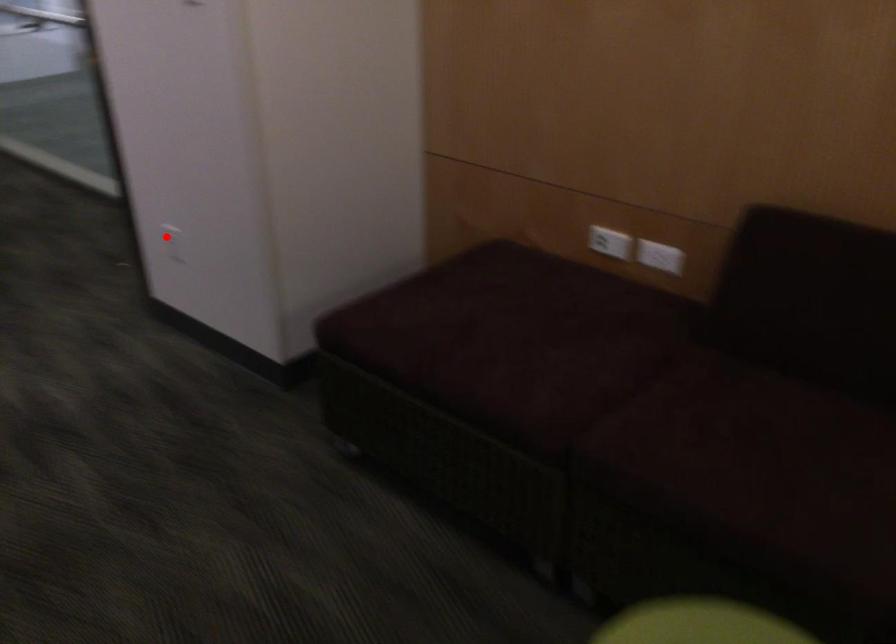
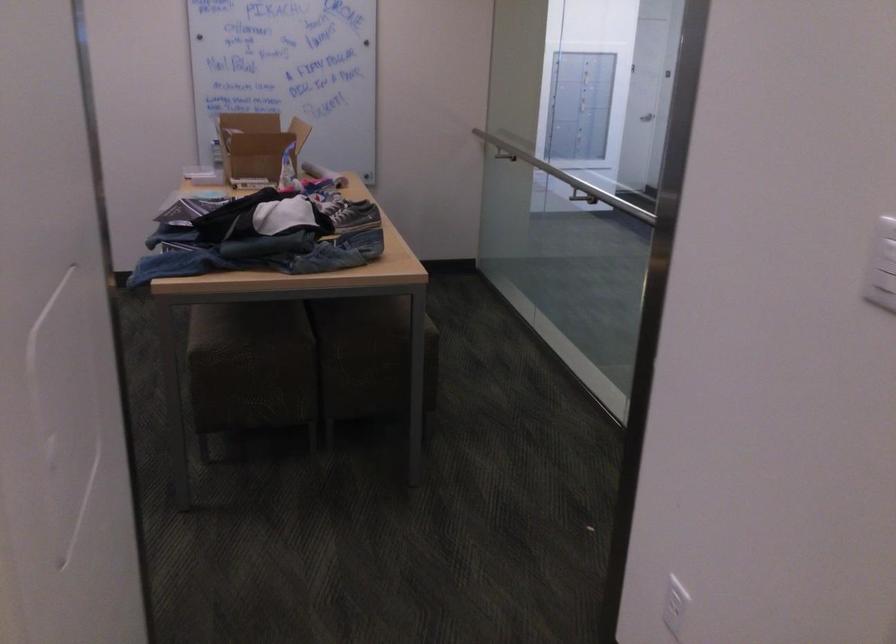
Question: I am providing you with two images of the same scene from different viewpoints. In image1, a red point is highlighted. Considering the same 3D point in image2, which of the following is correct?

Choices:
 (A) It is closer
 (B) It is farther

Answer: (A)